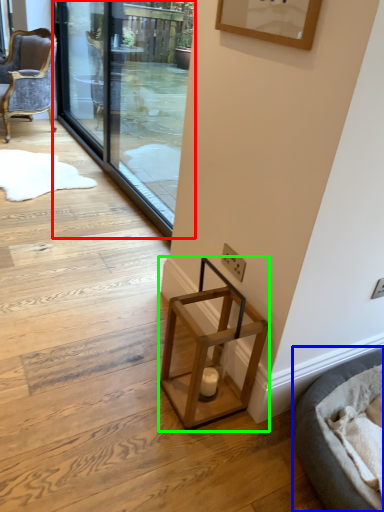
Question: Which object is positioned farthest from screen door (highlighted by a red box)? Select from cat bed (highlighted by a blue box) and stool (highlighted by a green box).

Choices:
 (A) cat bed
 (B) stool

Answer: (A)